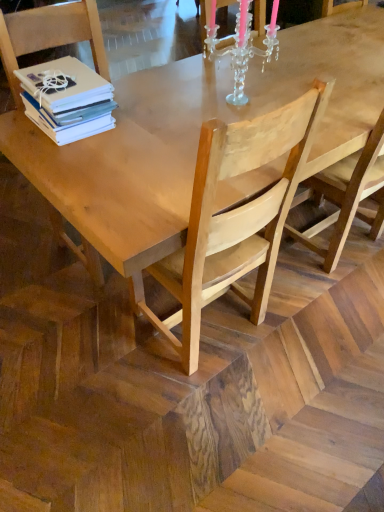
This screenshot has height=512, width=384. I want to click on vacant area in front of light brown wood chair at left, arranged as the 1th chair when viewed from the left, so click(75, 313).